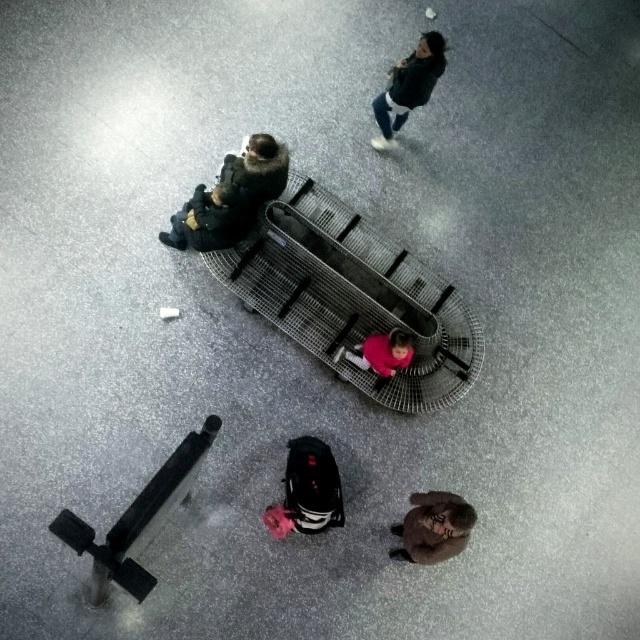
You are a photographer standing at the center of the mall. You see the dark gray fabric jacket at upper left and the brown fuzzy coat at lower right. Which one is higher up in the image?

The dark gray fabric jacket at upper left is higher up in the image than the brown fuzzy coat at lower right.